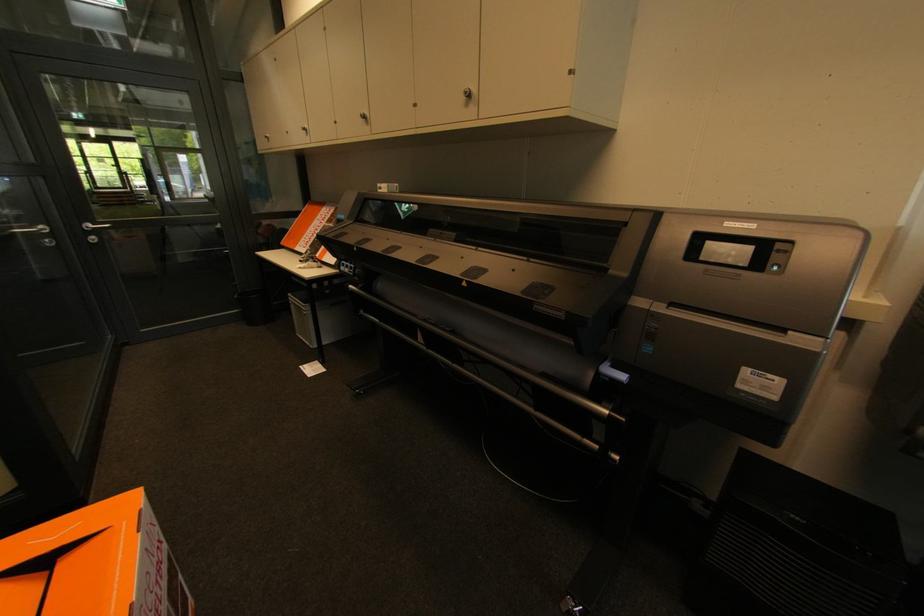
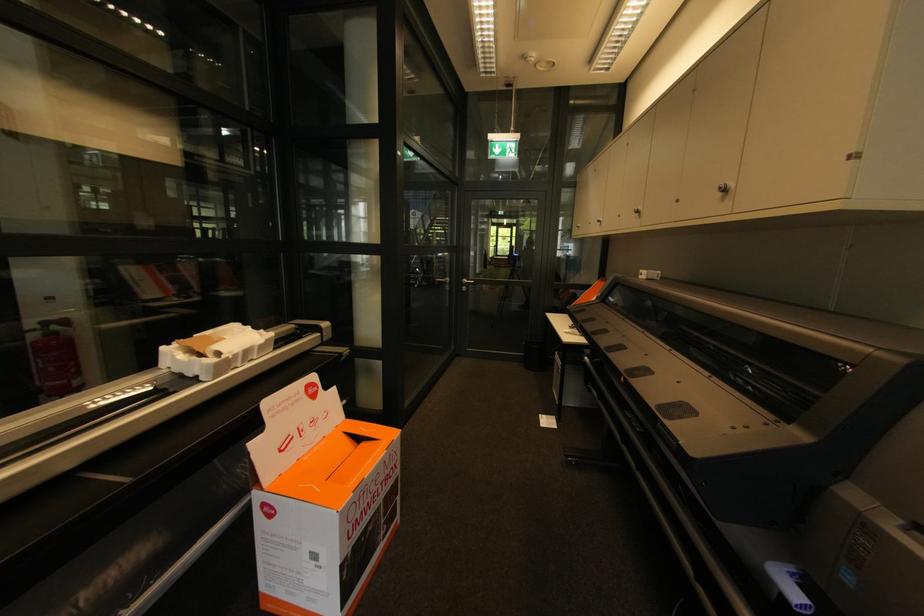
Locate, in the second image, the point that corresponds to (472,95) in the first image.

(727, 191)